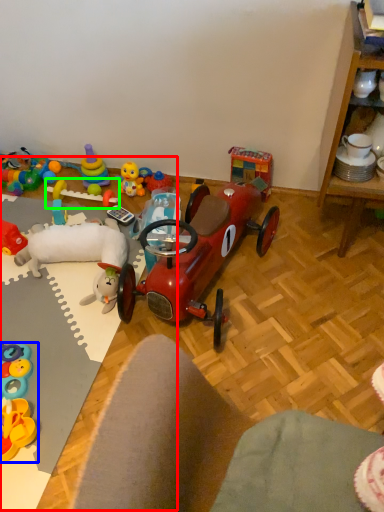
Question: Estimate the real-world distances between objects in this image. Which object is closer to table (highlighted by a red box), toy (highlighted by a blue box) or toy (highlighted by a green box)?

Choices:
 (A) toy
 (B) toy

Answer: (A)